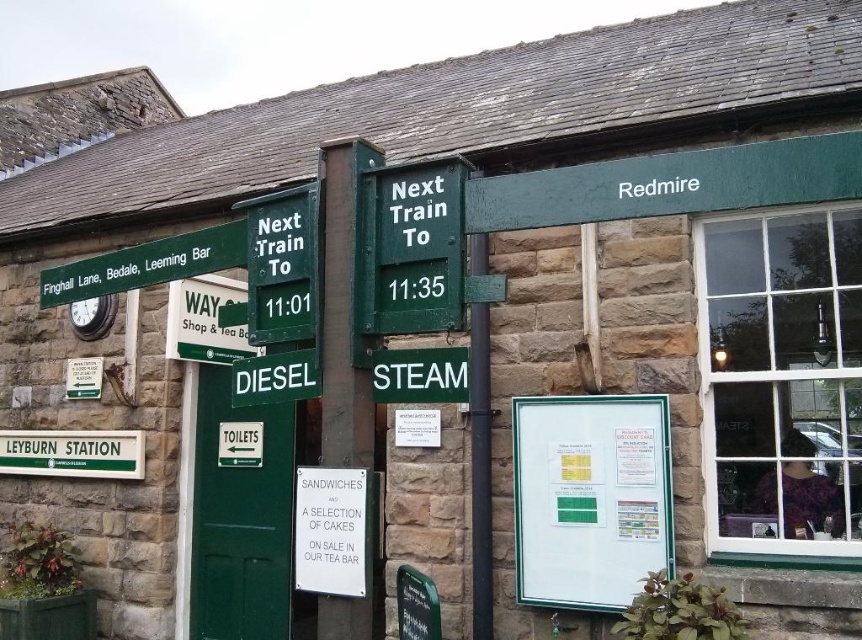
Between whiteboard at center and green metal signboard at lower left, which one is positioned higher?

whiteboard at center

Is point (672, 561) positioned before point (111, 468)?

Yes, it is in front of point (111, 468).

This screenshot has height=640, width=862. What are the coordinates of `whiteboard at center` in the screenshot? It's located at (590, 499).

Does green metal signboard at lower left have a lesser width compared to green matte signboard at center?

Incorrect, green metal signboard at lower left's width is not less than green matte signboard at center's.

Is the position of green metal signboard at lower left more distant than that of green matte signboard at center?

That is True.

This screenshot has width=862, height=640. Identify the location of green metal signboard at lower left. (72, 452).

This screenshot has height=640, width=862. Find the location of `green metal signboard at lower left`. green metal signboard at lower left is located at coordinates (72, 452).

Is white paper sign at center thinner than green metal signboard at lower left?

Yes.

Does white paper sign at center lie behind green metal signboard at lower left?

No.

Find the location of a particular element. white paper sign at center is located at coordinates (330, 531).